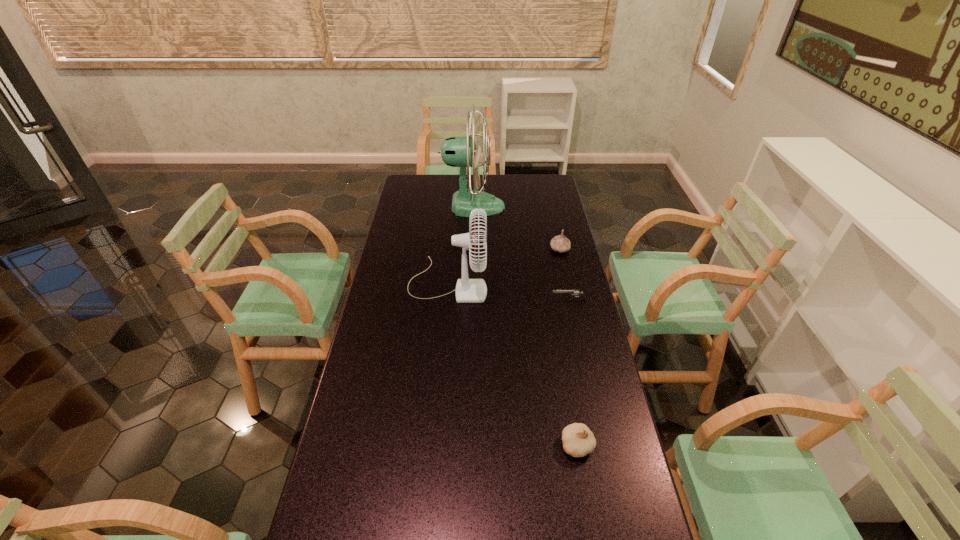
The width and height of the screenshot is (960, 540). In order to click on object that ranks as the third closest to the nearest object in this screenshot , I will do `click(560, 243)`.

Find the location of `garlic that can be found as the second closest to the pistol`. garlic that can be found as the second closest to the pistol is located at coordinates (578, 440).

Locate which garlic ranks second in proximity to the farthest object. Please provide its 2D coordinates. Your answer should be formatted as a tuple, i.e. [(x, y)], where the tuple contains the x and y coordinates of a point satisfying the conditions above.

[(578, 440)]

Locate an element on the screen. free point that satisfies the following two spatial constraints: 1. in front of the tallest object, directing airflow; 2. on the left side of the nearer garlic is located at coordinates (468, 446).

I want to click on blank space that satisfies the following two spatial constraints: 1. on the front-facing side of the second tallest object; 2. on the right side of the nearest object, so (434, 446).

At what (x,y) coordinates should I click in order to perform the action: click on vacant space that satisfies the following two spatial constraints: 1. on the front-facing side of the nearest object; 2. on the left side of the second tallest object. Please return your answer as a coordinate pair (x, y). Looking at the image, I should click on (434, 446).

The height and width of the screenshot is (540, 960). Identify the location of free region that satisfies the following two spatial constraints: 1. on the front-facing side of the shorter fan; 2. on the back side of the nearest object. (434, 446).